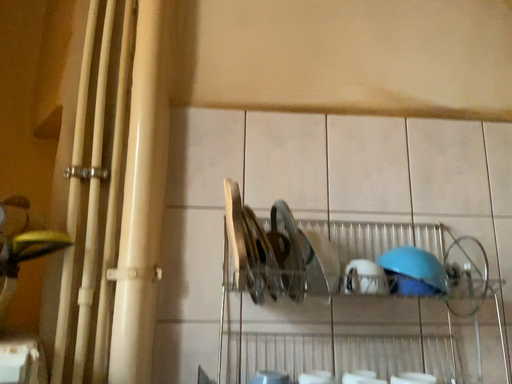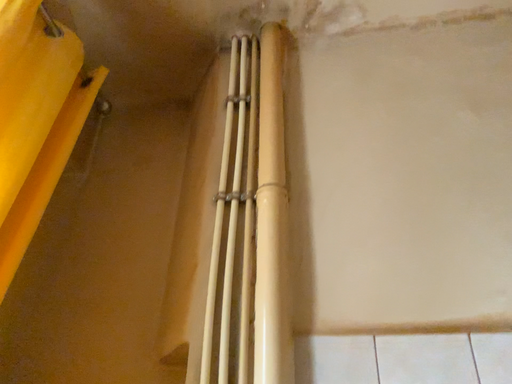
Question: How did the camera likely rotate when shooting the video?

Choices:
 (A) rotated upward
 (B) rotated downward

Answer: (A)